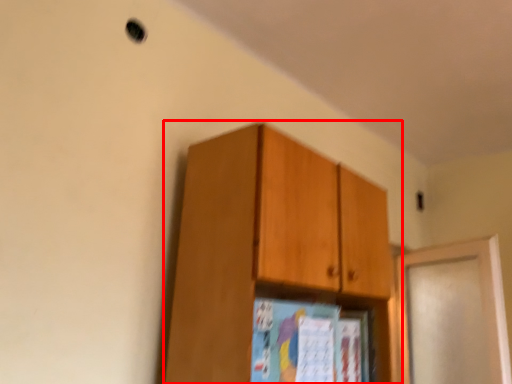
Question: From the image's perspective, where is cabinetry (annotated by the red box) located relative to door?

Choices:
 (A) above
 (B) below

Answer: (A)